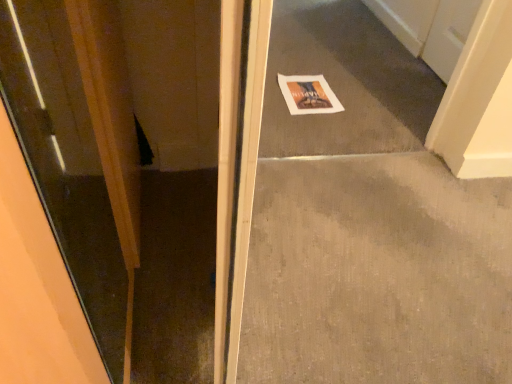
In order to face white paper at center, should I rotate leftwards or rightwards?

It's best to rotate right around 7.256 degrees.

What do you see at coordinates (308, 95) in the screenshot? I see `white paper at center` at bounding box center [308, 95].

Where is `white paper at center`? The height and width of the screenshot is (384, 512). white paper at center is located at coordinates (308, 95).

What is the approximate height of white paper at center?

The height of white paper at center is 1.25 inches.

Find the location of a particular element. This screenshot has height=384, width=512. white paper at center is located at coordinates (308, 95).